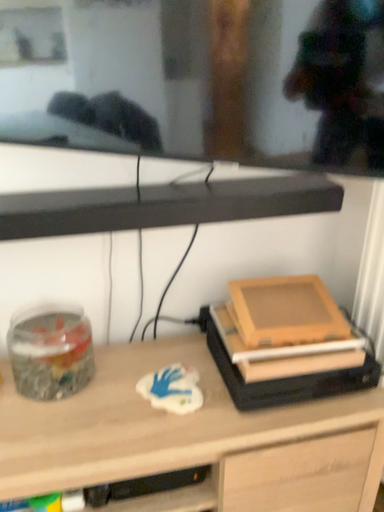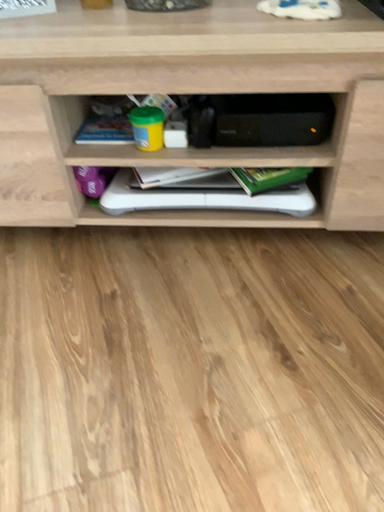
Question: Which way did the camera rotate in the video?

Choices:
 (A) rotated right
 (B) rotated left

Answer: (B)